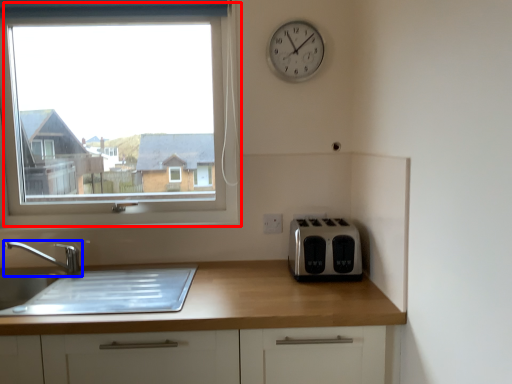
Question: Which object is further to the camera taking this photo, window (highlighted by a red box) or tap (highlighted by a blue box)?

Choices:
 (A) window
 (B) tap

Answer: (A)